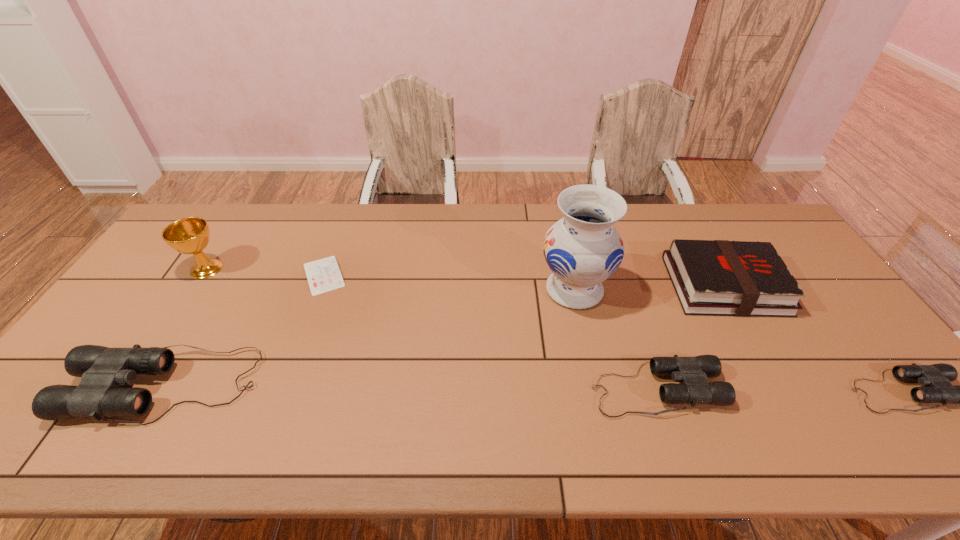
The height and width of the screenshot is (540, 960). Find the location of `vacant area at the far right corner of the desktop`. vacant area at the far right corner of the desktop is located at coordinates (729, 221).

You are a GUI agent. You are given a task and a screenshot of the screen. Output one action in this format:
    pyautogui.click(x=<x>, y=<y>)
    Task: Click on the free point between the vase and the leftmost binoculars
    The image size is (960, 540).
    Given the screenshot: What is the action you would take?
    pyautogui.click(x=371, y=338)

You are a GUI agent. You are given a task and a screenshot of the screen. Output one action in this format:
    pyautogui.click(x=<x>, y=<y>)
    Task: Click on the free space between the diary and the second shortest binoculars
    The image size is (960, 540).
    Given the screenshot: What is the action you would take?
    pyautogui.click(x=490, y=333)

Identify the location of vacant area that lies between the tallest object and the hardback book. (649, 288).

I want to click on free space between the second tallest object and the diary, so click(265, 272).

I want to click on free point between the tallest binoculars and the hardback book, so click(445, 336).

I want to click on empty space that is in between the hardback book and the diary, so click(x=524, y=280).

You are a GUI agent. You are given a task and a screenshot of the screen. Output one action in this format:
    pyautogui.click(x=<x>, y=<y>)
    Task: Click on the empty space that is in between the shortest object and the chalice
    The image size is (960, 540).
    Given the screenshot: What is the action you would take?
    pyautogui.click(x=265, y=272)

Identify which object is the sixth closest to the tallest object. Please provide its 2D coordinates. Your answer should be formatted as a tuple, i.e. [(x, y)], where the tuple contains the x and y coordinates of a point satisfying the conditions above.

[(191, 235)]

At what (x,y) coordinates should I click in order to perform the action: click on object that is the fifth closest one to the tallest binoculars. Please return your answer as a coordinate pair (x, y). The image size is (960, 540). Looking at the image, I should click on (711, 277).